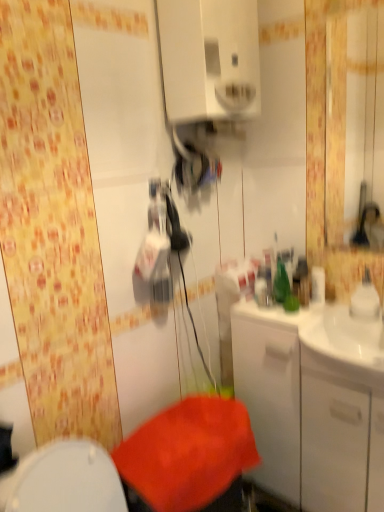
Question: From the image's perspective, is white glossy medicine cabinet at upper center above glossy plastic mirror at upper right?

Choices:
 (A) yes
 (B) no

Answer: (A)

Question: Is white glossy medicine cabinet at upper center with glossy plastic mirror at upper right?

Choices:
 (A) no
 (B) yes

Answer: (A)

Question: Considering the relative sizes of white glossy medicine cabinet at upper center and glossy plastic mirror at upper right in the image provided, is white glossy medicine cabinet at upper center bigger than glossy plastic mirror at upper right?

Choices:
 (A) no
 (B) yes

Answer: (B)

Question: Does white glossy medicine cabinet at upper center appear on the left side of glossy plastic mirror at upper right?

Choices:
 (A) yes
 (B) no

Answer: (A)

Question: From a real-world perspective, is white glossy medicine cabinet at upper center on top of glossy plastic mirror at upper right?

Choices:
 (A) no
 (B) yes

Answer: (B)

Question: Considering the positions of point (344, 133) and point (276, 478), is point (344, 133) closer or farther from the camera than point (276, 478)?

Choices:
 (A) farther
 (B) closer

Answer: (A)

Question: In terms of width, does glossy plastic mirror at upper right look wider or thinner when compared to white glossy cabinet at right?

Choices:
 (A) wide
 (B) thin

Answer: (B)

Question: Based on their sizes in the image, would you say glossy plastic mirror at upper right is bigger or smaller than white glossy cabinet at right?

Choices:
 (A) small
 (B) big

Answer: (A)

Question: Would you say glossy plastic mirror at upper right is to the left or to the right of white glossy cabinet at right in the picture?

Choices:
 (A) right
 (B) left

Answer: (A)

Question: Considering the positions of point (208, 93) and point (359, 0), is point (208, 93) closer or farther from the camera than point (359, 0)?

Choices:
 (A) farther
 (B) closer

Answer: (B)

Question: From a real-world perspective, is white glossy medicine cabinet at upper center above or below glossy plastic mirror at upper right?

Choices:
 (A) below
 (B) above

Answer: (B)

Question: Looking at their shapes, would you say white glossy medicine cabinet at upper center is wider or thinner than glossy plastic mirror at upper right?

Choices:
 (A) thin
 (B) wide

Answer: (B)

Question: In the image, is white glossy medicine cabinet at upper center positioned in front of or behind glossy plastic mirror at upper right?

Choices:
 (A) front
 (B) behind

Answer: (A)

Question: Is white glossy cabinet at right bigger or smaller than white glossy medicine cabinet at upper center?

Choices:
 (A) big
 (B) small

Answer: (A)

Question: Considering their positions, is white glossy cabinet at right located in front of or behind white glossy medicine cabinet at upper center?

Choices:
 (A) behind
 (B) front

Answer: (A)